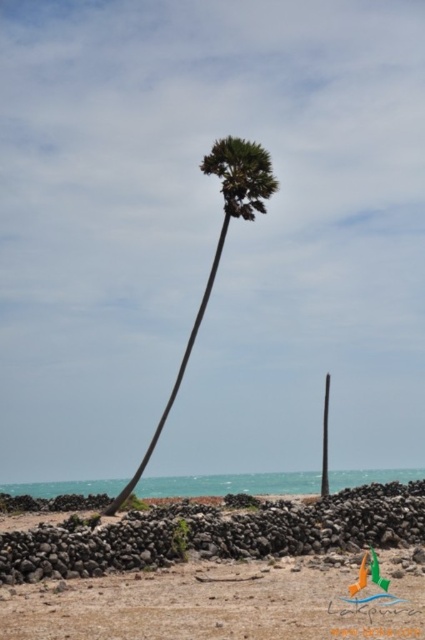
You are standing on the brown sandy beach at lower center and want to reach the green leafy palm tree at center. Which direction should you move to get closer to the palm tree?

To reach the green leafy palm tree at center from the brown sandy beach at lower center, you should move upward since the palm tree is located above the sandy beach.

Looking at this image, you are standing at the center of the image and want to walk to the brown sandy beach at lower center. According to the coordinates provided, in which direction should you move?

The brown sandy beach at lower center is located at coordinates point (217, 602). Since the coordinates are given as x,y where lower values of x indicate left and higher values of y indicate up, you should move to the right and slightly upwards to reach the brown sandy beach at lower center.